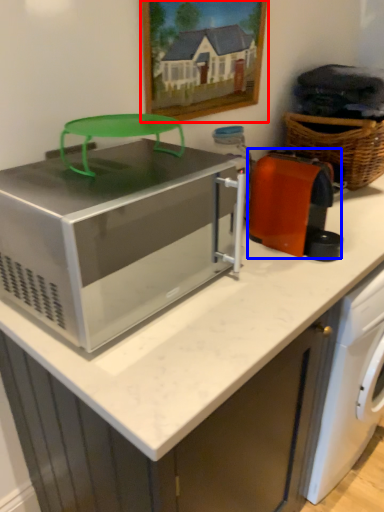
Question: Which of the following is the closest to the observer, picture frame (highlighted by a red box) or appliance (highlighted by a blue box)?

Choices:
 (A) picture frame
 (B) appliance

Answer: (B)